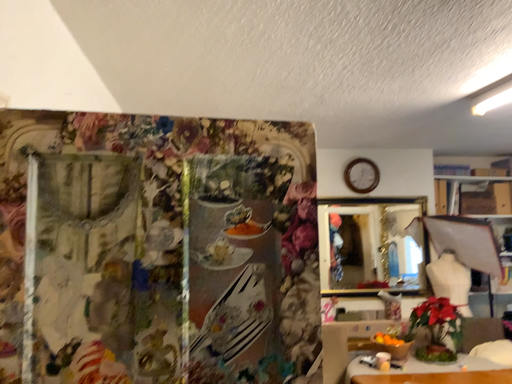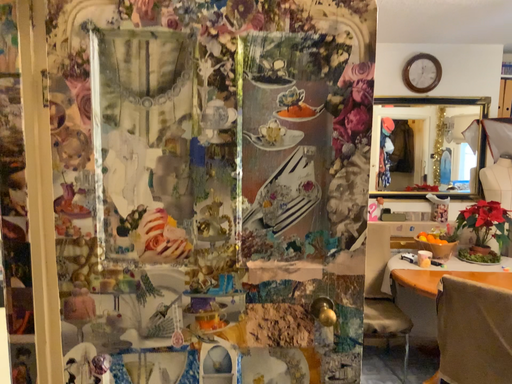
Question: Which way did the camera rotate in the video?

Choices:
 (A) rotated right
 (B) rotated left

Answer: (B)